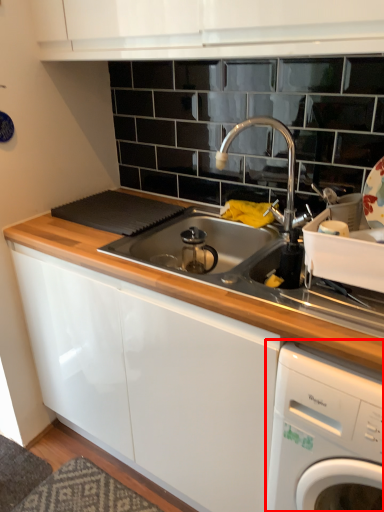
Question: From the image's perspective, where is home appliance (annotated by the red box) located in relation to tap in the image?

Choices:
 (A) above
 (B) below

Answer: (B)